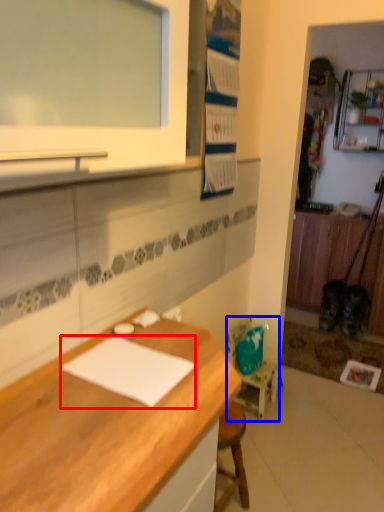
Question: Which point is closer to the camera, notepad (highlighted by a red box) or chair (highlighted by a blue box)?

Choices:
 (A) notepad
 (B) chair

Answer: (A)